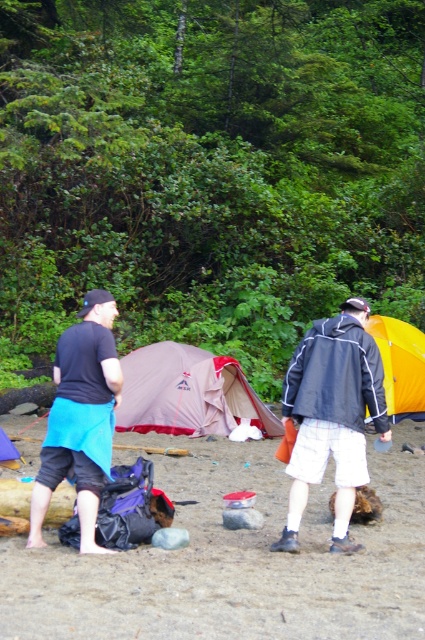
Who is lower down, brown sandy beach at lower center or blue fabric shorts at lower left?

brown sandy beach at lower center is below.

Between point (274, 508) and point (59, 413), which one is positioned behind?

The point (274, 508) is behind.

At what (x,y) coordinates should I click in order to perform the action: click on brown sandy beach at lower center. Please return your answer as a coordinate pair (x, y). The width and height of the screenshot is (425, 640). Looking at the image, I should click on (235, 561).

Between blue fabric shorts at lower left and yellow fabric tent at right, which one is positioned lower?

blue fabric shorts at lower left is below.

Does blue fabric shorts at lower left have a greater height compared to yellow fabric tent at right?

Yes, blue fabric shorts at lower left is taller than yellow fabric tent at right.

The image size is (425, 640). What do you see at coordinates (81, 417) in the screenshot?
I see `blue fabric shorts at lower left` at bounding box center [81, 417].

Where is `blue fabric shorts at lower left`? blue fabric shorts at lower left is located at coordinates (81, 417).

Where is `dark gray jacket at center`? This screenshot has height=640, width=425. dark gray jacket at center is located at coordinates (331, 416).

Is dark gray jacket at center positioned at the back of matte pink tent at center?

No, it is in front of matte pink tent at center.

The image size is (425, 640). Identify the location of dark gray jacket at center. (331, 416).

You are a GUI agent. You are given a task and a screenshot of the screen. Output one action in this format:
    pyautogui.click(x=<x>, y=<y>)
    Task: Click on the dark gray jacket at center
    
    Given the screenshot: What is the action you would take?
    (331, 416)